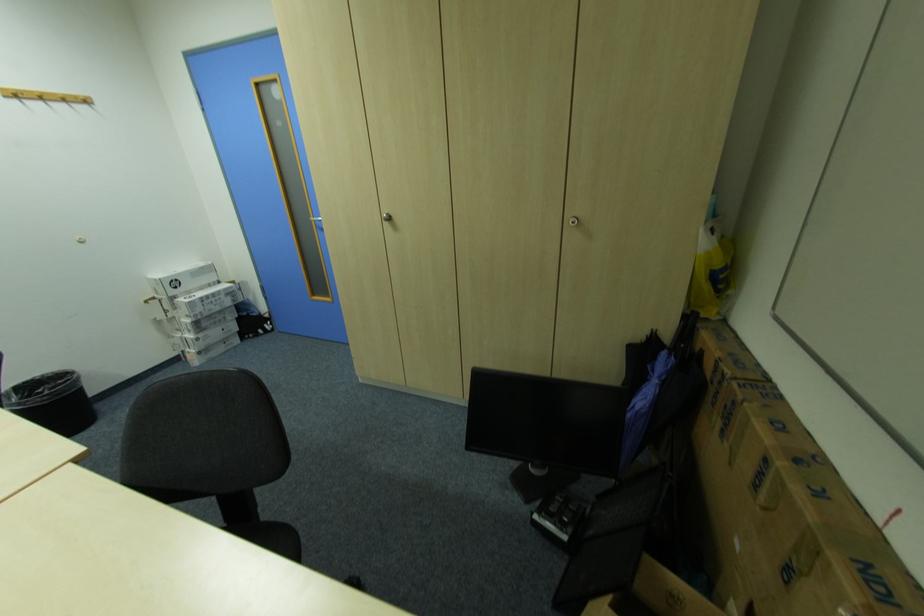
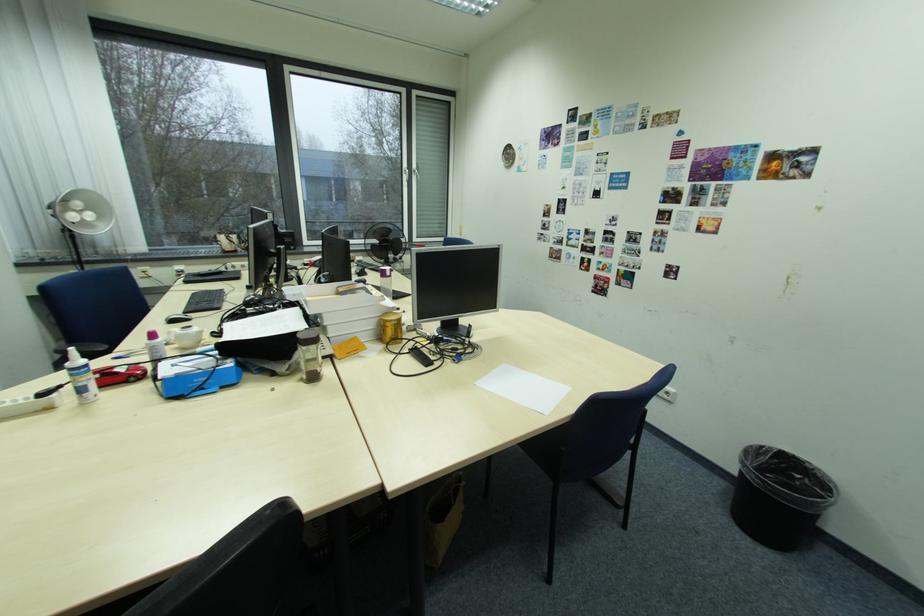
Where in the second image is the point corresponding to [49,391] from the first image?

(807, 477)